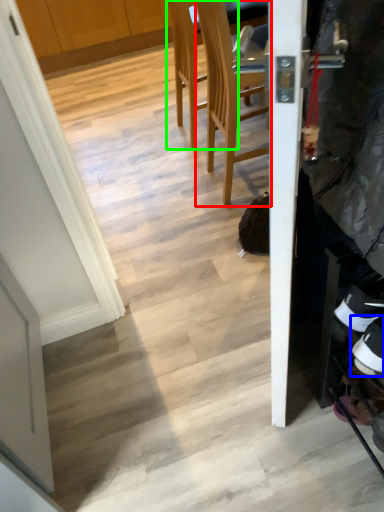
Question: Considering the real-world distances, which object is closest to chair (highlighted by a red box)? footwear (highlighted by a blue box) or chair (highlighted by a green box).

Choices:
 (A) footwear
 (B) chair

Answer: (B)